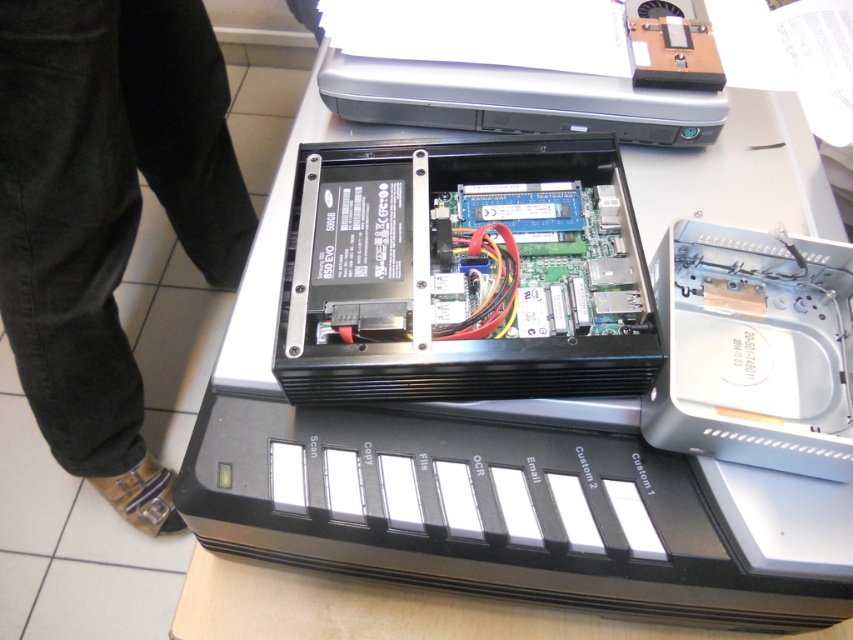
Question: Is black corduroy pants at lower center positioned at the back of satin silver printer at upper center?

Choices:
 (A) yes
 (B) no

Answer: (B)

Question: Which object appears farthest from the camera in this image?

Choices:
 (A) black corduroy pants at lower center
 (B) satin silver printer at upper center

Answer: (B)

Question: Can you confirm if black corduroy pants at lower center is smaller than satin silver printer at upper center?

Choices:
 (A) yes
 (B) no

Answer: (B)

Question: Which point is closer to the camera?

Choices:
 (A) black corduroy pants at lower center
 (B) satin silver printer at upper center

Answer: (A)

Question: Is black corduroy pants at lower center bigger than satin silver printer at upper center?

Choices:
 (A) no
 (B) yes

Answer: (B)